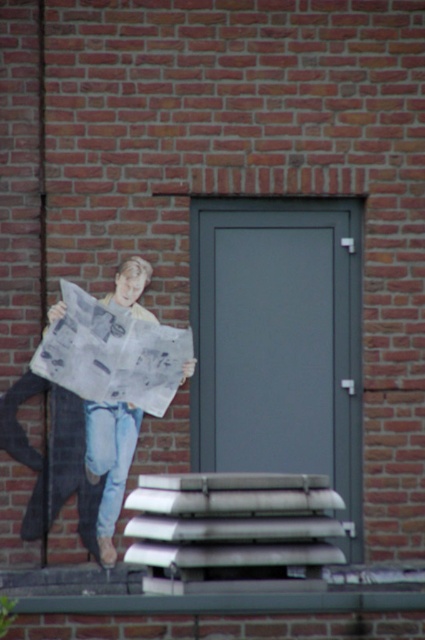
You are standing in front of the gray door and see a white printed newspaper at left and denim at left. Which object is taller?

The white printed newspaper at left is taller than denim at left.